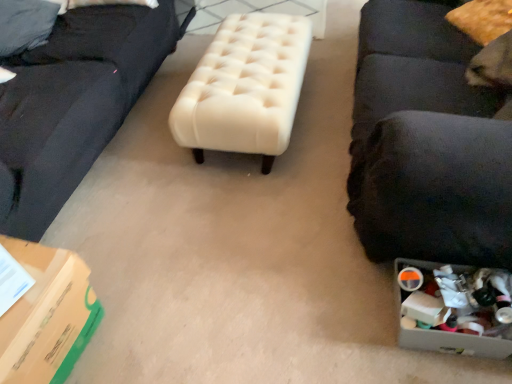
In order to click on vacant point above creamy velvet ottoman at center (from a real-world perspective) in this screenshot , I will do `click(243, 59)`.